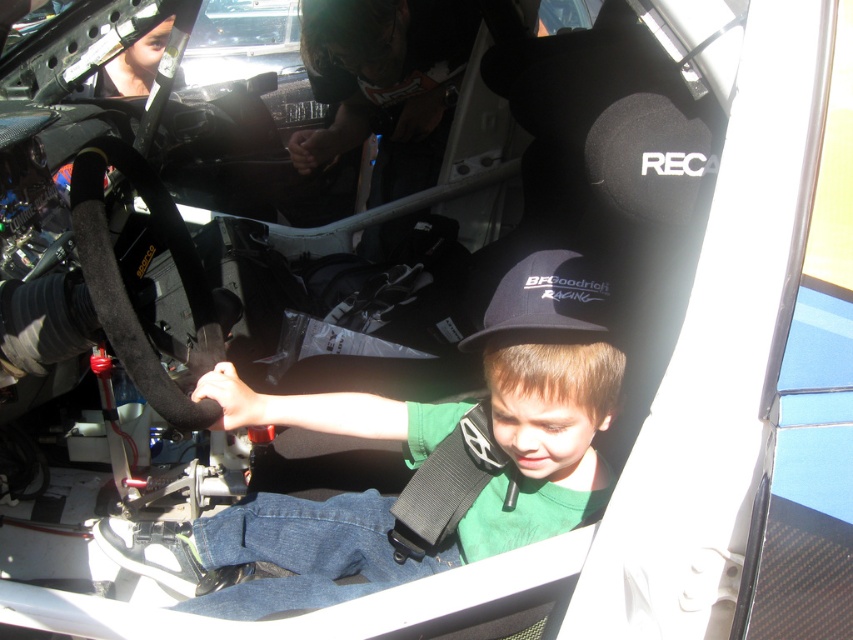
You are a race car engineer trying to install a new gear shifter. The gear shifter is 1.2 meters long. You need to place it between the point at [531,436] and another point. Can the gear shifter fit between these two points?

The distance between the point at [531,436] and the other point is 1.21 meters. Since the gear shifter is 1.2 meters long, it can fit between these two points as the available space is slightly larger than the gear shifter.